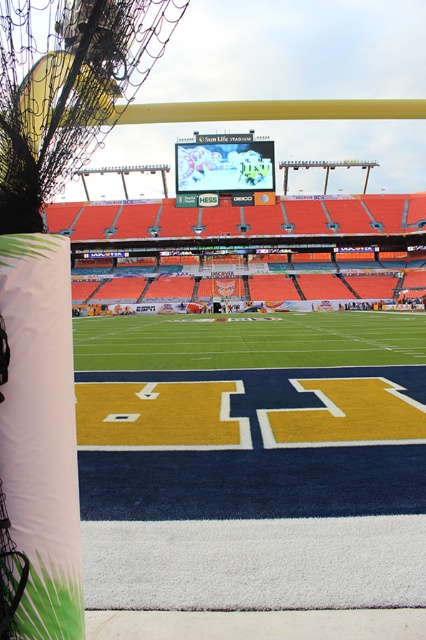
Which is below, white fabric banner at left or matte black scoreboard at center?

Positioned lower is white fabric banner at left.

Can you confirm if white fabric banner at left is positioned to the right of matte black scoreboard at center?

Result: Yes, white fabric banner at left is to the right of matte black scoreboard at center.

Is point (60, 317) closer to camera compared to point (212, 172)?

Yes, it is.

The width and height of the screenshot is (426, 640). I want to click on white fabric banner at left, so click(x=40, y=433).

Between yellow turf at center and green turf football field at center, which one is positioned lower?

yellow turf at center is below.

Is yellow turf at center shorter than green turf football field at center?

Correct, yellow turf at center is not as tall as green turf football field at center.

Who is more forward, (233, 509) or (72, 326)?

Point (233, 509) is more forward.

You are a GUI agent. You are given a task and a screenshot of the screen. Output one action in this format:
    pyautogui.click(x=<x>, y=<y>)
    Task: Click on the yellow turf at center
    The width and height of the screenshot is (426, 640).
    Given the screenshot: What is the action you would take?
    pyautogui.click(x=252, y=461)

Is green turf football field at center below matte black scoreboard at center?

Indeed, green turf football field at center is positioned under matte black scoreboard at center.

Does green turf football field at center have a smaller size compared to matte black scoreboard at center?

No, green turf football field at center is not smaller than matte black scoreboard at center.

What do you see at coordinates (247, 340) in the screenshot?
I see `green turf football field at center` at bounding box center [247, 340].

Where is `green turf football field at center`? green turf football field at center is located at coordinates (247, 340).